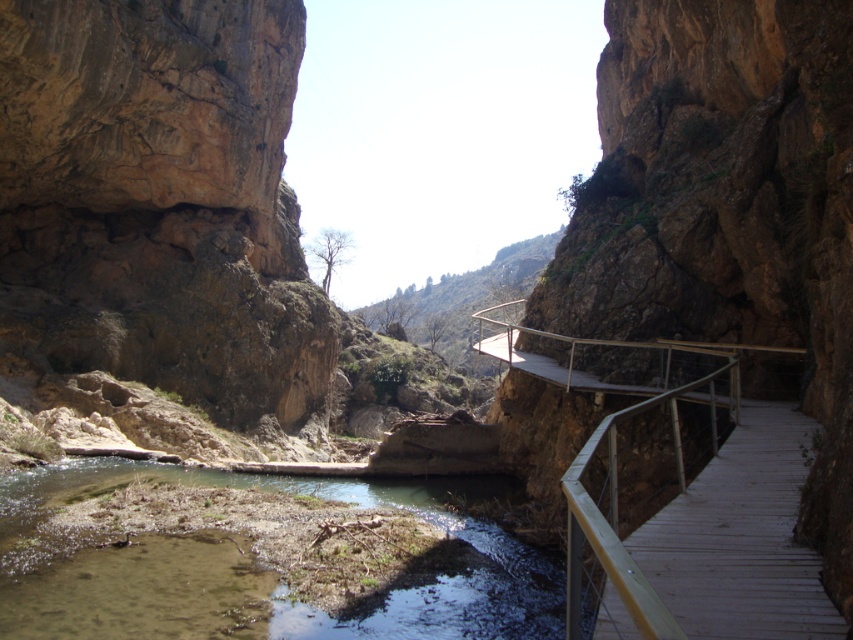
You are standing on the wooden walkway along the right side of the canyon and want to take a photo of the green mossy river at lower left. Which direction should you face to capture the river in your view?

You should face towards the lower left direction to capture the green mossy river at lower left in your view since it is located at point (x=254, y=579).

Based on the photo, you are a hiker carrying a 10 meter long rope. You want to cross from the wooden walkway at center to the green mossy river at lower left. Can you safely use your rope to make a bridge between them?

The distance between the green mossy river at lower left and the wooden walkway at center is 10.87 meters. Since your rope is only 10 meters long, it is not long enough to span the gap. You would need a longer rope to safely create a bridge between them.